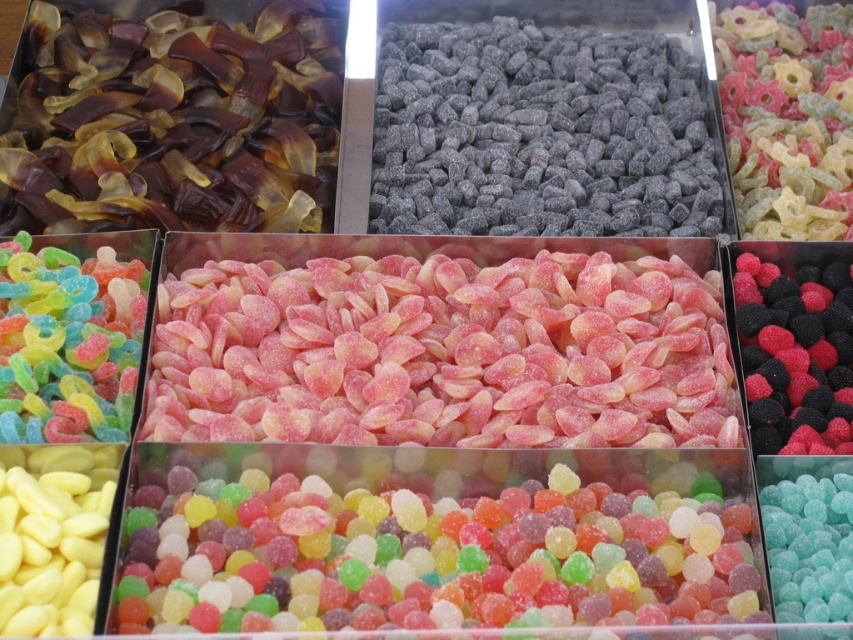
Question: Which point appears farthest from the camera in this image?

Choices:
 (A) (737, 269)
 (B) (790, 154)
 (C) (804, 508)
 (D) (83, 364)

Answer: (B)

Question: Can you confirm if glossy sugar-coated candies at center is positioned below teal glossy gumballs at bottom right?

Choices:
 (A) yes
 (B) no

Answer: (B)

Question: Is glossy sugar-coated candies at center above translucent sugar-coated rings at center?

Choices:
 (A) yes
 (B) no

Answer: (B)

Question: Which of these objects is positioned farthest from the teal glossy gumballs at bottom right?

Choices:
 (A) glossy sugar-coated candies at center
 (B) translucent yellow gummy bear at center
 (C) translucent sugar-coated rings at center

Answer: (C)

Question: Which of the following is the closest to the observer?

Choices:
 (A) translucent yellow gummy bear at center
 (B) translucent sugar-coated rings at center

Answer: (B)

Question: Is glossy sugar-coated candies at center behind translucent yellow gummy bear at center?

Choices:
 (A) no
 (B) yes

Answer: (A)